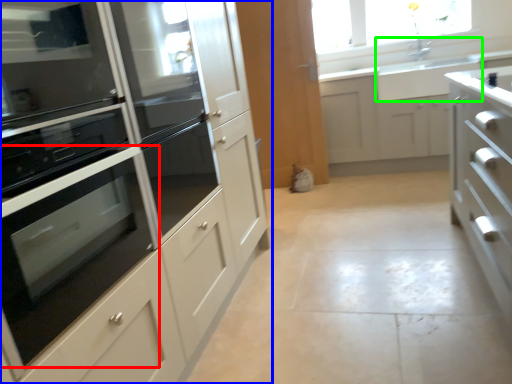
Question: Which object is the closest to the oven (highlighted by a red box)? Choose among these: cabinetry (highlighted by a blue box) or sink (highlighted by a green box).

Choices:
 (A) cabinetry
 (B) sink

Answer: (A)